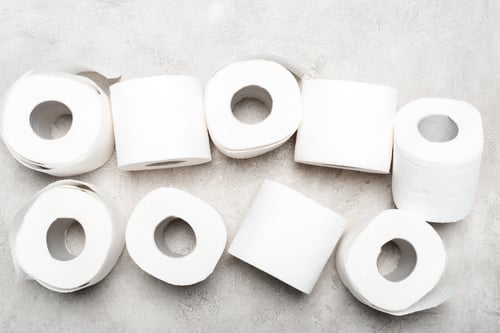
Locate an element on the screen. The image size is (500, 333). toilet paper rolls is located at coordinates (82, 143), (102, 243), (153, 138), (154, 219), (247, 132), (301, 236), (347, 125), (378, 252), (470, 175).